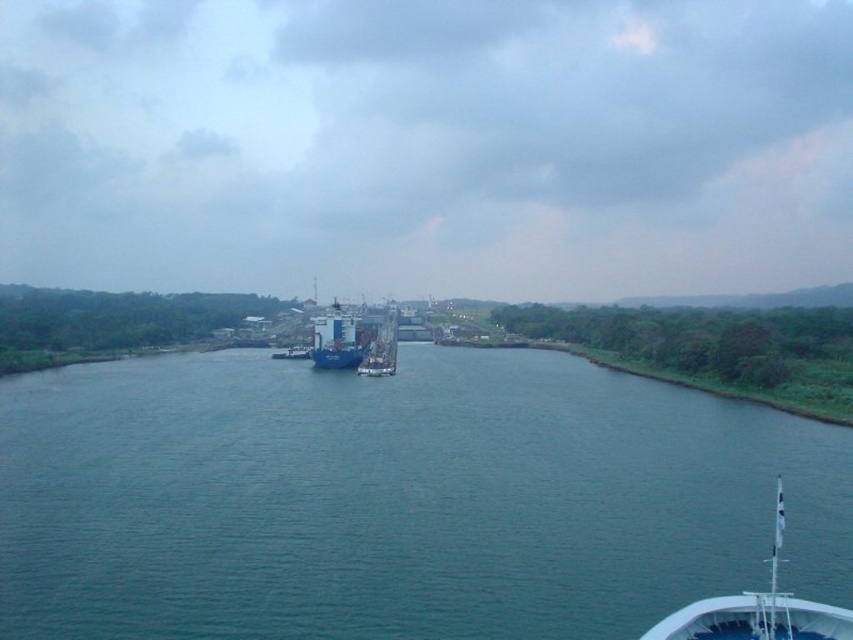
You are a drone operator trying to capture aerial footage of the canal. You have two points marked on your map, point (x=722, y=499) and point (x=648, y=634). Which point is closer to your current position as the drone flies over the canal?

Point (x=722, y=499) is closer to the drone operator because it is further to the viewer than point (x=648, y=634), meaning it is physically nearer in the line of sight.

You are a tour guide leading a group of visitors on a sightseeing boat. You notice a white glossy boat at lower right and a blue matte container ship at center in the canal. Your boat is 120 meters long. Can you safely navigate between them without colliding?

The white glossy boat at lower right is 102.74 meters away from the blue matte container ship at center. Since your boat is 120 meters long, which is longer than the distance between them, you cannot safely navigate between them without risking a collision.

You are standing at the point marked as point (403, 424). The large blue and white cargo ship is in the center of the canal. If you want to take a photo of the ship from your current position, will you be able to capture the entire ship in the frame without moving? Please consider the distance between you and the ship.

The distance between you and the ship is 71.24 meters. Whether you can capture the entire ship depends on your camera lens. A standard lens might require moving closer, but a wide angle lens could potentially capture the ship from this distance.